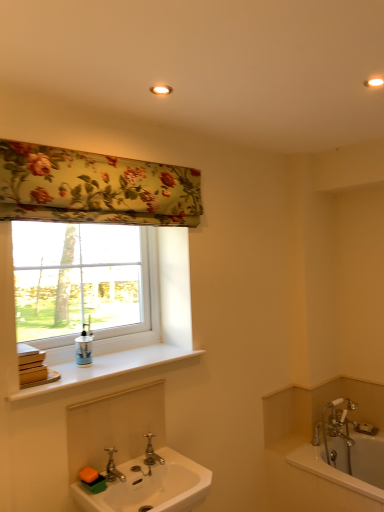
The height and width of the screenshot is (512, 384). What are the coordinates of `free space in front of white glossy soap dispenser at window` in the screenshot? It's located at (79, 375).